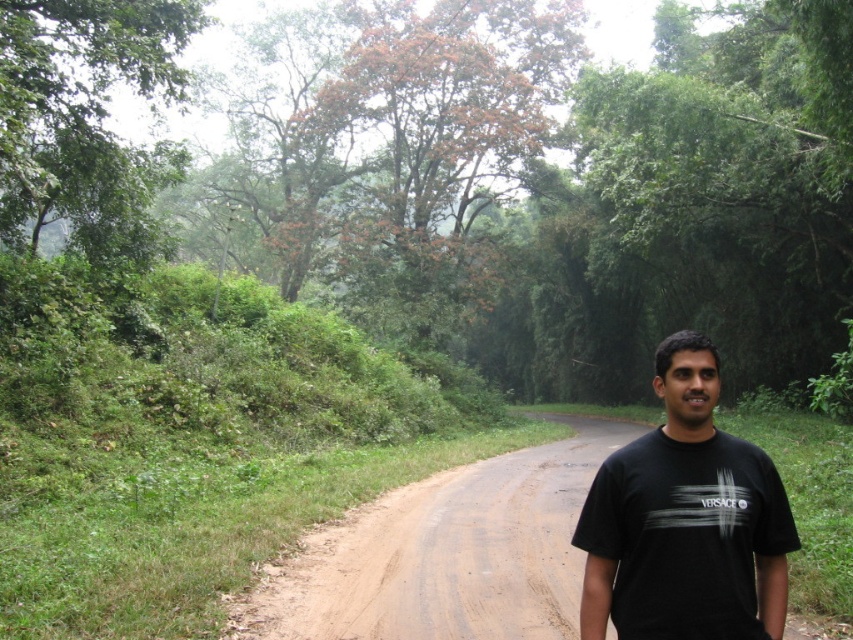
Question: Which object appears closest to the camera in this image?

Choices:
 (A) brown dirt track at center
 (B) black matte t-shirt at center

Answer: (B)

Question: Which object appears closest to the camera in this image?

Choices:
 (A) black matte t-shirt at center
 (B) brown dirt track at center

Answer: (A)

Question: Is brown dirt track at center in front of black matte t-shirt at center?

Choices:
 (A) yes
 (B) no

Answer: (B)

Question: Is brown dirt track at center below black matte t-shirt at center?

Choices:
 (A) yes
 (B) no

Answer: (A)

Question: From the image, what is the correct spatial relationship of brown dirt track at center in relation to black matte t-shirt at center?

Choices:
 (A) left
 (B) right

Answer: (B)

Question: Which of the following is the closest to the observer?

Choices:
 (A) brown dirt track at center
 (B) black matte t-shirt at center

Answer: (B)